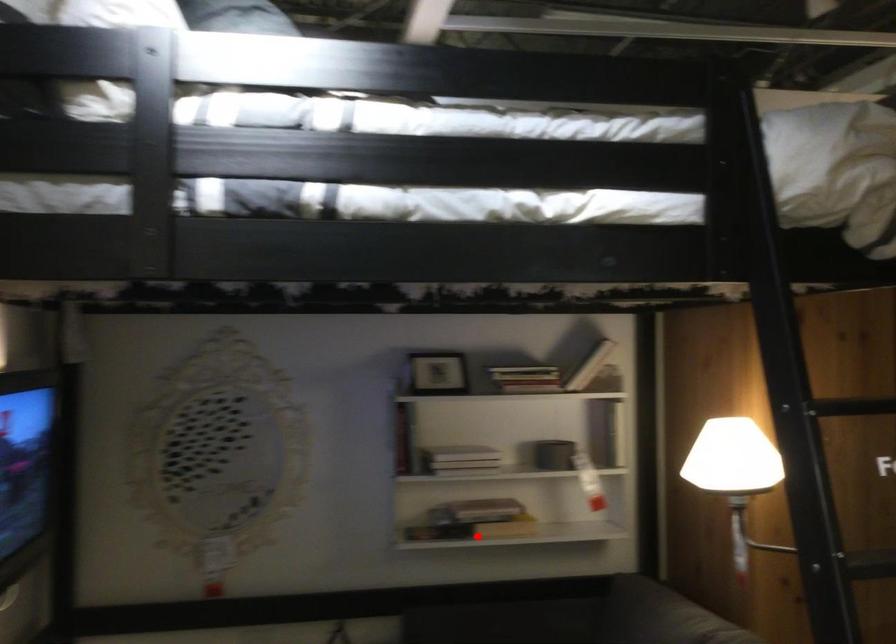
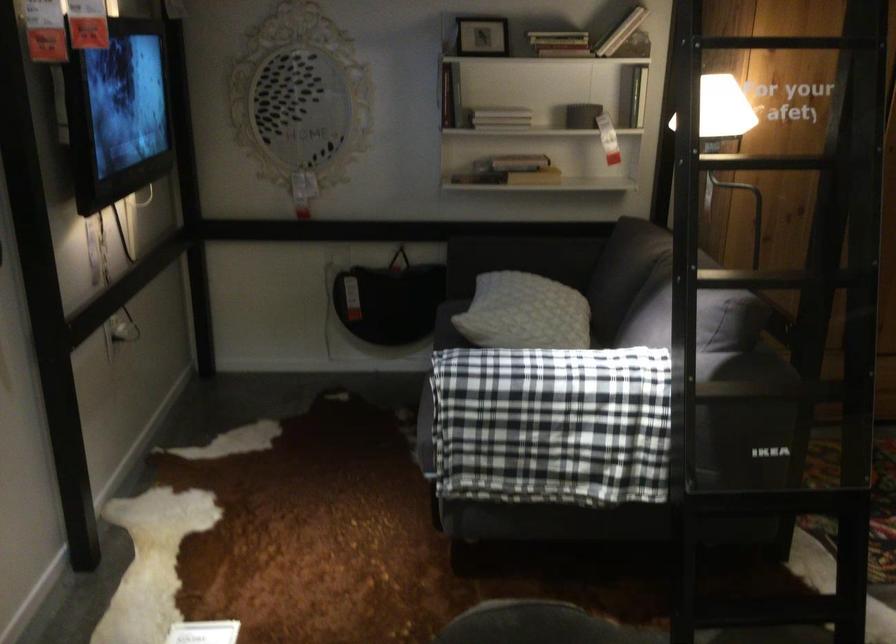
Question: I am providing you with two images of the same scene from different viewpoints. Image1 has a red point marked. In image2, the corresponding 3D location appears at what relative position? Reply with the corresponding letter.

Choices:
 (A) Closer
 (B) Farther

Answer: (B)